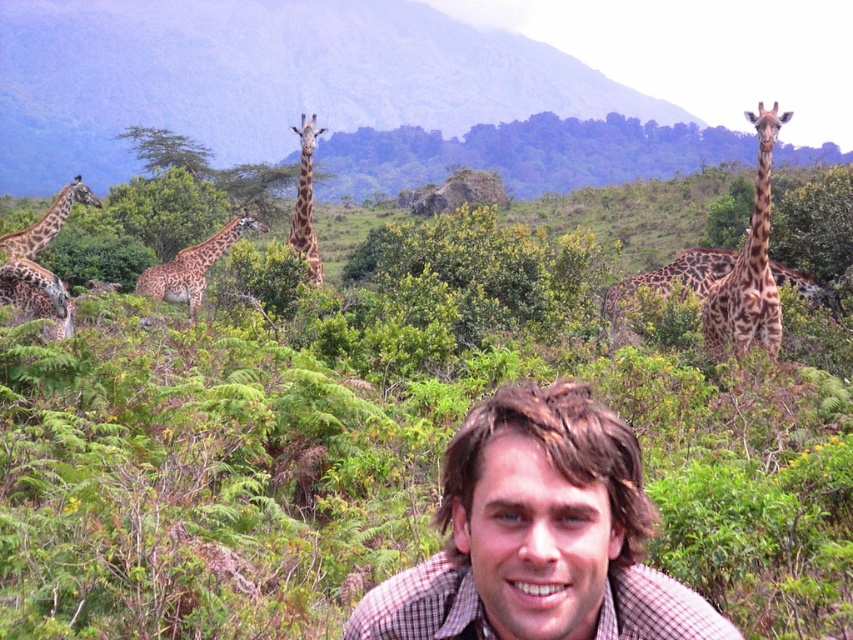
Is spotted brown giraffe at right wider than spotted brown giraffe at center?

Indeed, spotted brown giraffe at right has a greater width compared to spotted brown giraffe at center.

Describe the element at coordinates (669, 280) in the screenshot. The image size is (853, 640). I see `spotted brown giraffe at right` at that location.

You are a GUI agent. You are given a task and a screenshot of the screen. Output one action in this format:
    pyautogui.click(x=<x>, y=<y>)
    Task: Click on the spotted brown giraffe at right
    
    Given the screenshot: What is the action you would take?
    pyautogui.click(x=669, y=280)

Does point (502, 282) come behind point (228, 240)?

No, (502, 282) is closer to viewer.

Is green leafy bush at center shorter than spotted brown giraffe at center?

No.

What do you see at coordinates (380, 448) in the screenshot? I see `green leafy bush at center` at bounding box center [380, 448].

Where is `green leafy bush at center`? green leafy bush at center is located at coordinates [x=380, y=448].

Who is more distant from viewer, (698, 260) or (306, 186)?

The point (698, 260) is more distant.

Does spotted brown giraffe at right appear on the left side of spotted fur giraffe at center?

Incorrect, spotted brown giraffe at right is not on the left side of spotted fur giraffe at center.

Looking at this image, measure the distance between spotted brown giraffe at right and camera.

The distance of spotted brown giraffe at right from camera is 12.90 meters.

You are a GUI agent. You are given a task and a screenshot of the screen. Output one action in this format:
    pyautogui.click(x=<x>, y=<y>)
    Task: Click on the spotted brown giraffe at right
    This screenshot has height=640, width=853.
    Given the screenshot: What is the action you would take?
    pyautogui.click(x=669, y=280)